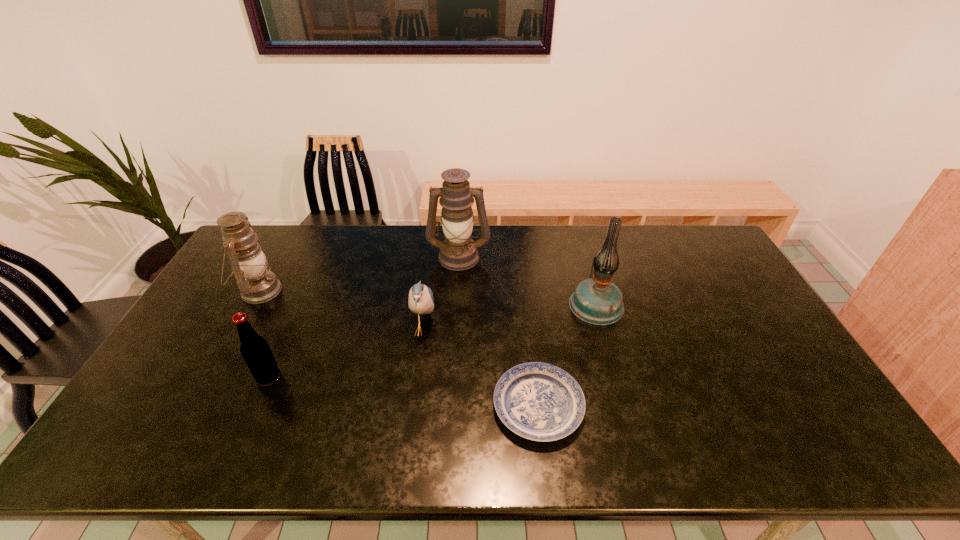
Locate an element on the screen. The image size is (960, 540). the farthest object is located at coordinates (458, 252).

Locate an element on the screen. the farthest oil lamp is located at coordinates (458, 252).

At what (x,y) coordinates should I click in order to perform the action: click on the rightmost oil lamp. Please return your answer as a coordinate pair (x, y). This screenshot has width=960, height=540. Looking at the image, I should click on click(598, 301).

Locate an element on the screen. Image resolution: width=960 pixels, height=540 pixels. the leftmost oil lamp is located at coordinates [x=249, y=261].

The image size is (960, 540). Identify the location of the fifth object from right to left. (254, 349).

The image size is (960, 540). Identify the location of beer bottle. (254, 349).

You are a GUI agent. You are given a task and a screenshot of the screen. Output one action in this format:
    pyautogui.click(x=<x>, y=<y>)
    Task: Click on the bird
    
    Given the screenshot: What is the action you would take?
    pyautogui.click(x=421, y=301)

Locate an element on the screen. plate is located at coordinates (538, 401).

Where is `vacant space located 0.270m on the right of the farthest oil lamp`? This screenshot has width=960, height=540. vacant space located 0.270m on the right of the farthest oil lamp is located at coordinates (565, 256).

In order to click on free space located on the left of the rightmost object in this screenshot , I will do `click(524, 304)`.